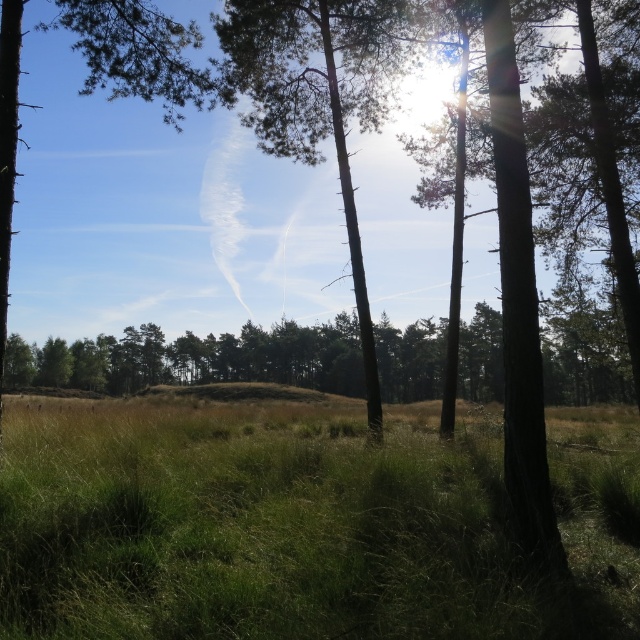
Question: Does green grassy at center appear on the right side of smooth bark tree at center?

Choices:
 (A) yes
 (B) no

Answer: (A)

Question: Among these points, which one is farthest from the camera?

Choices:
 (A) (499, 563)
 (B) (380, 417)

Answer: (B)

Question: Can you confirm if green grassy at center is positioned below smooth bark tree at center?

Choices:
 (A) no
 (B) yes

Answer: (B)

Question: Is green grassy at center smaller than smooth bark tree at center?

Choices:
 (A) no
 (B) yes

Answer: (B)